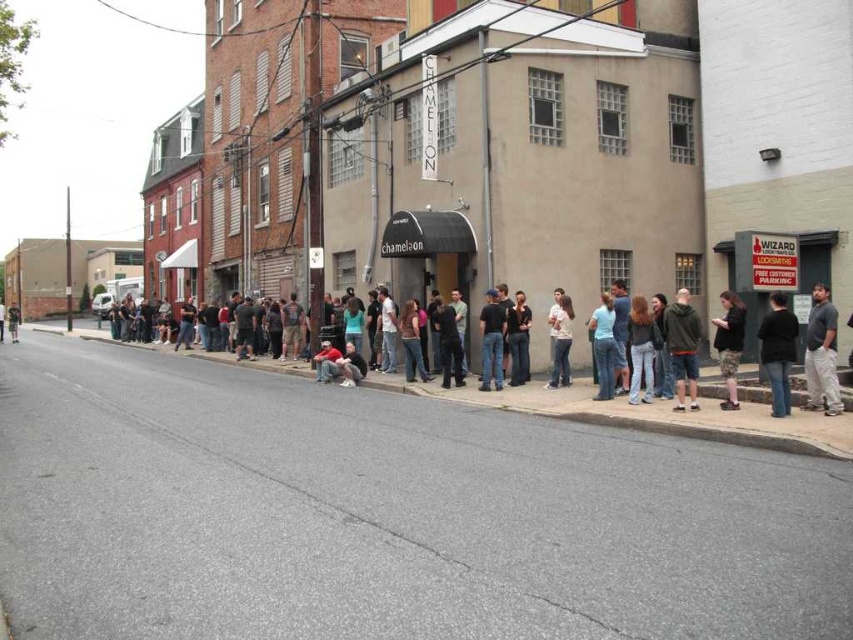
Question: Which of these objects is positioned farthest from the dark gray fabric jacket at center?

Choices:
 (A) denim jacket at center
 (B) dark gray hoodie at center
 (C) dark gray shirt at lower right
 (D) denim jeans at center

Answer: (C)

Question: Does black matte jacket at lower right come in front of light blue denim jeans at center?

Choices:
 (A) no
 (B) yes

Answer: (B)

Question: Where is black matte jacket at lower right located in relation to dark gray hoodie at center in the image?

Choices:
 (A) left
 (B) right

Answer: (B)

Question: Which object is closer to the camera taking this photo?

Choices:
 (A) denim jeans at center
 (B) light blue denim jeans at center

Answer: (B)

Question: Among these points, which one is farthest from the camera?

Choices:
 (A) (753, 426)
 (B) (833, 330)

Answer: (B)

Question: Is dark gray hoodie at center below black jeans at center?

Choices:
 (A) yes
 (B) no

Answer: (A)